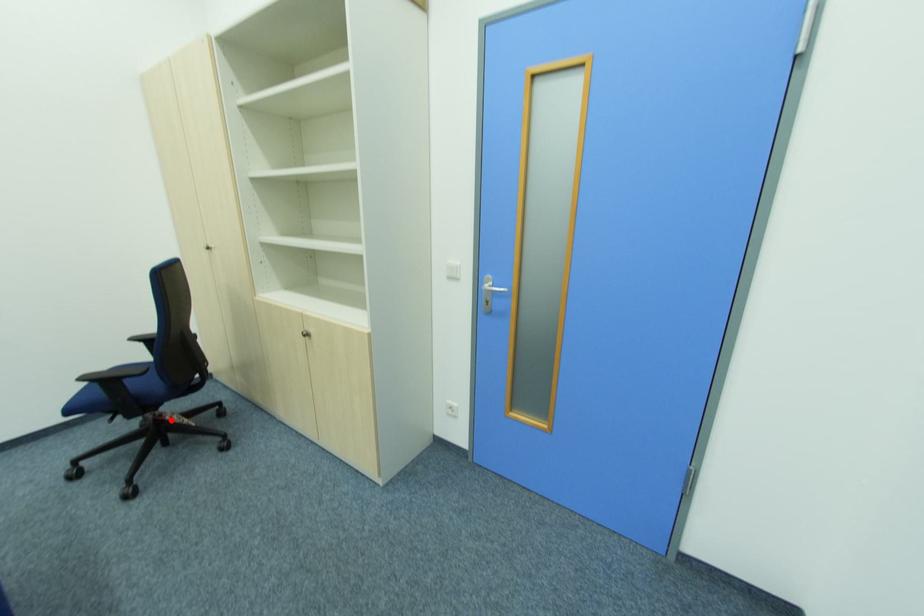
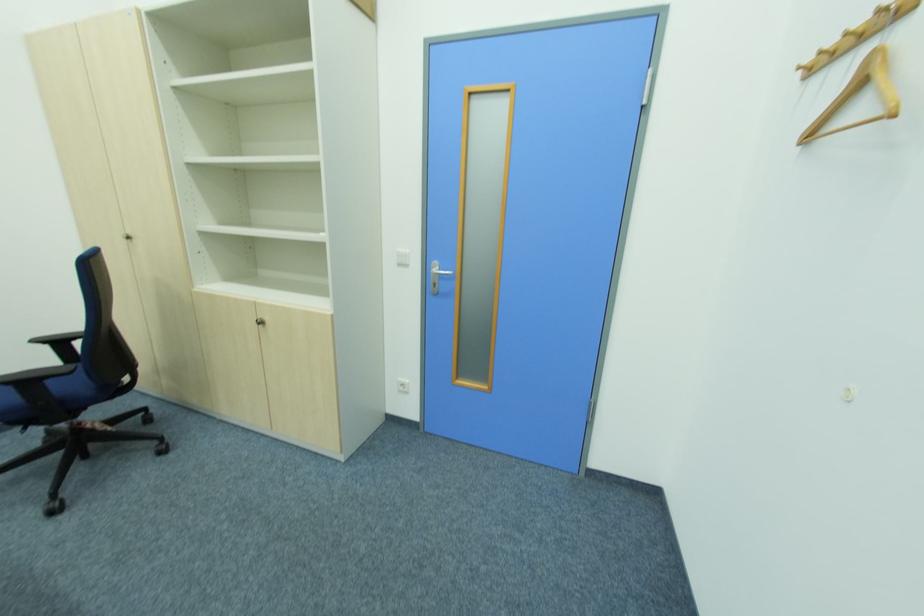
Question: I am providing you with two images of the same scene from different viewpoints. Given a red point in image1, look at the same physical point in image2. Is it:

Choices:
 (A) Closer to the viewpoint
 (B) Farther from the viewpoint

Answer: (A)